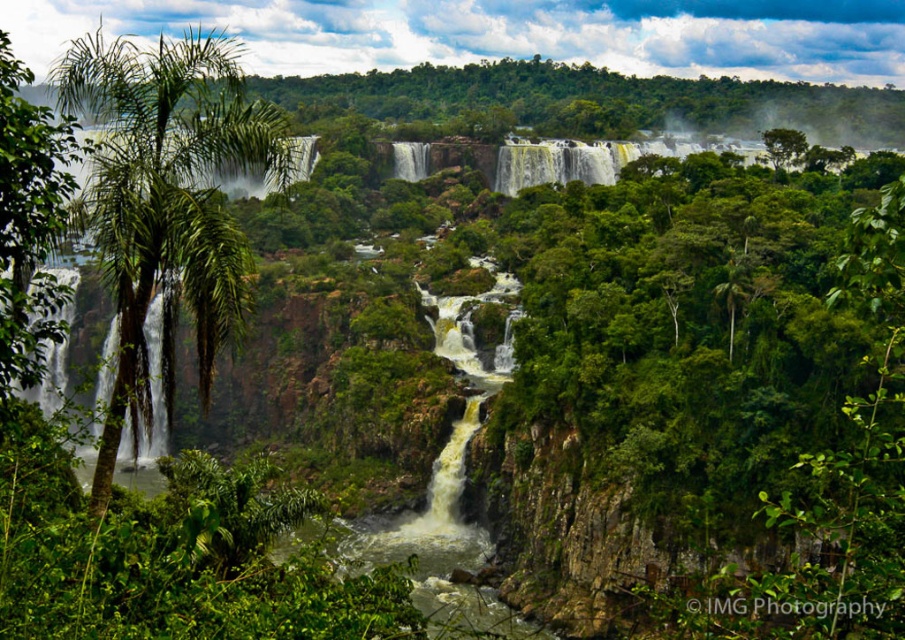
Question: Is green leafy palm tree at left wider than green leafy tree at left?

Choices:
 (A) yes
 (B) no

Answer: (A)

Question: Among these points, which one is farthest from the camera?

Choices:
 (A) (206, 132)
 (B) (12, 172)

Answer: (A)

Question: Which of the following is the closest to the observer?

Choices:
 (A) green leafy palm tree at left
 (B) green leafy tree at left

Answer: (B)

Question: Can you confirm if green leafy palm tree at left is positioned to the right of green leafy tree at left?

Choices:
 (A) no
 (B) yes

Answer: (A)

Question: Which point appears farthest from the camera in this image?

Choices:
 (A) (106, 60)
 (B) (5, 332)

Answer: (A)

Question: Is green leafy palm tree at left smaller than green leafy tree at left?

Choices:
 (A) no
 (B) yes

Answer: (A)